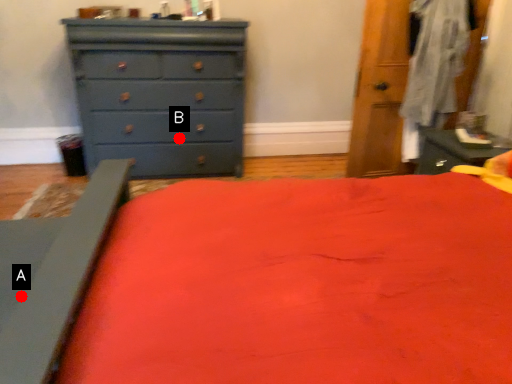
Question: Two points are circled on the image, labeled by A and B beside each circle. Which of the following is the closest to the observer?

Choices:
 (A) A is closer
 (B) B is closer

Answer: (A)